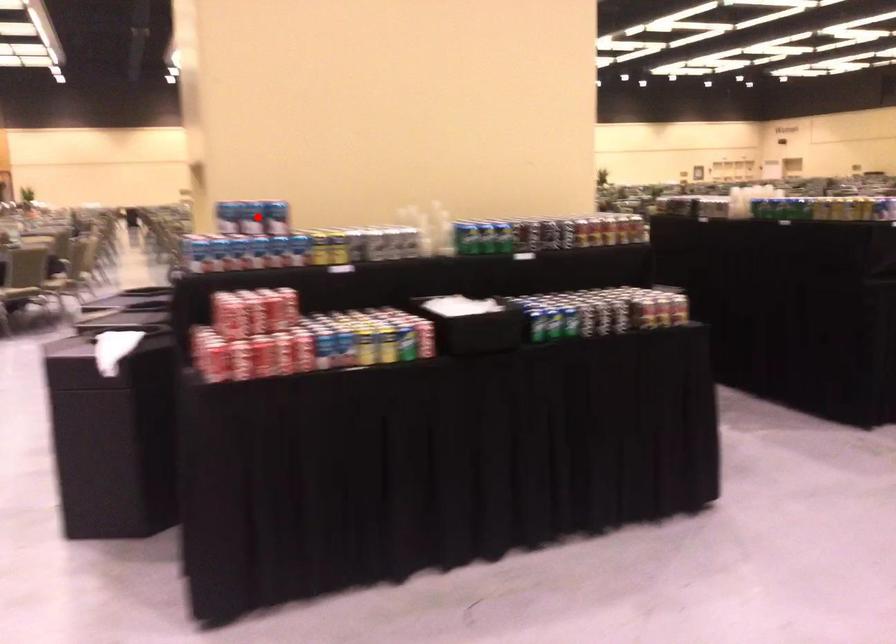
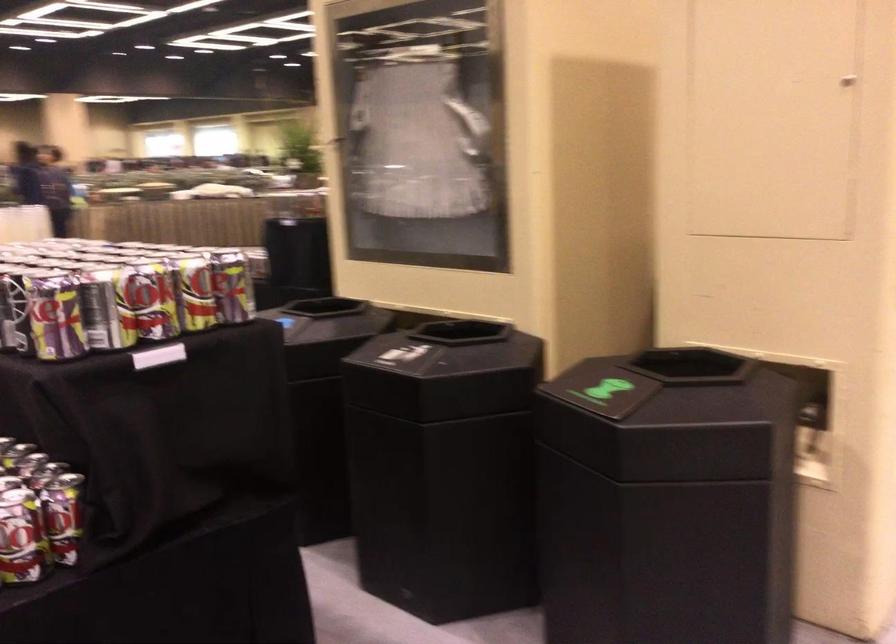
Question: I am providing you with two images of the same scene from different viewpoints. A red point is marked on the first image. Can you still see the location of the red point in image 2?

Choices:
 (A) Yes
 (B) No

Answer: (B)